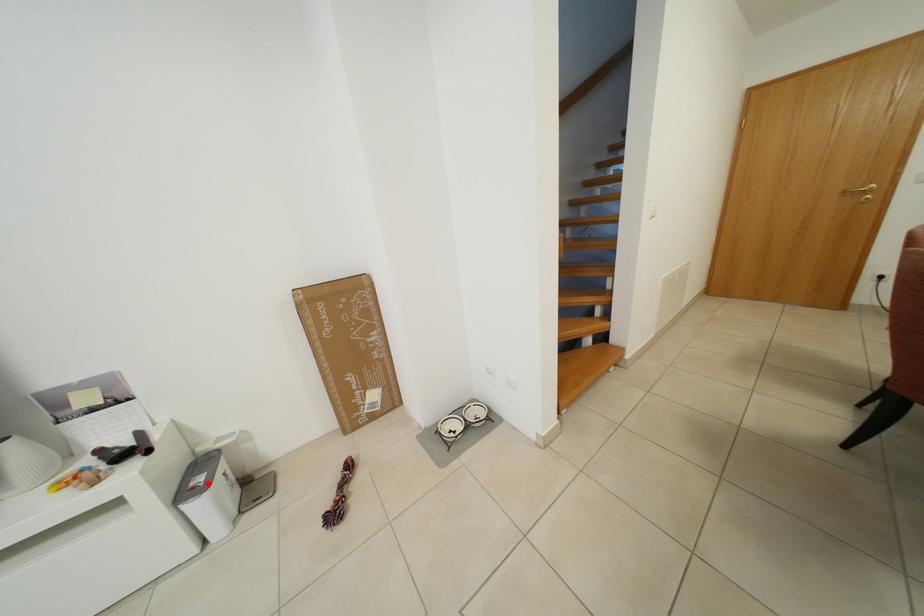
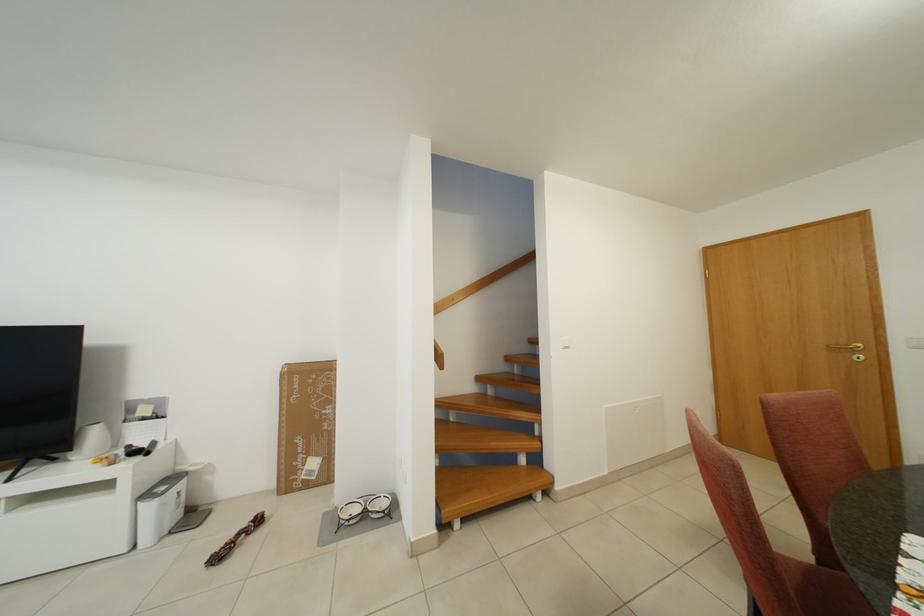
Locate, in the second image, the point that corresponds to the highlighted location in the first image.

(171, 493)